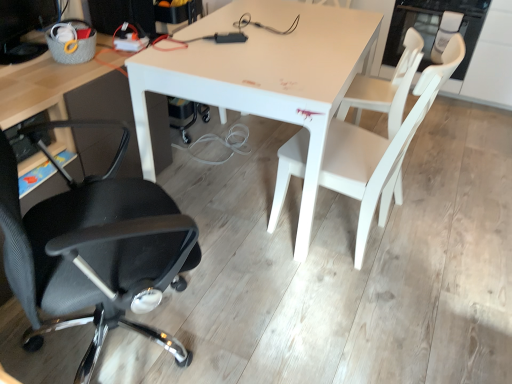
The image size is (512, 384). I want to click on matte black computer monitor at upper left, so click(x=24, y=28).

What is the approximate height of matte black computer monitor at upper left?

matte black computer monitor at upper left is 10.61 inches in height.

Locate an element on the screen. This screenshot has height=384, width=512. white matte chair at right, acting as the third chair starting from the left is located at coordinates (386, 87).

You are a GUI agent. You are given a task and a screenshot of the screen. Output one action in this format:
    pyautogui.click(x=<x>, y=<y>)
    Task: Click on the white matte table at center
    
    Given the screenshot: What is the action you would take?
    pyautogui.click(x=262, y=75)

Describe the element at coordinates (380, 152) in the screenshot. This screenshot has width=512, height=384. I see `white matte chair at center, which is counted as the second chair, starting from the right` at that location.

Locate an element on the screen. The image size is (512, 384). matte black computer monitor at upper left is located at coordinates (24, 28).

Between matte black computer monitor at upper left and white matte chair at right, acting as the third chair starting from the left, which one has more height?

white matte chair at right, acting as the third chair starting from the left.

How distant is matte black computer monitor at upper left from white matte chair at right, acting as the third chair starting from the left?

A distance of 1.43 meters exists between matte black computer monitor at upper left and white matte chair at right, acting as the third chair starting from the left.

Is point (11, 6) closer to camera compared to point (342, 106)?

Yes.

Locate an element on the screen. The image size is (512, 384). the 3rd chair located beneath the matte black computer monitor at upper left (from a real-world perspective) is located at coordinates (386, 87).

Considering the positions of points (291, 63) and (77, 381), is point (291, 63) closer to camera compared to point (77, 381)?

No, it is not.

From a real-world perspective, is white matte table at center located beneath black mesh office chair at left, arranged as the first chair when viewed from the left?

Yes, from a real-world perspective, white matte table at center is under black mesh office chair at left, arranged as the first chair when viewed from the left.

Does white matte table at center have a larger size compared to black mesh office chair at left, which is counted as the 3th chair, starting from the right?

Indeed, white matte table at center has a larger size compared to black mesh office chair at left, which is counted as the 3th chair, starting from the right.

Can you confirm if white matte table at center is shorter than black mesh office chair at left, arranged as the first chair when viewed from the left?

Correct, white matte table at center is not as tall as black mesh office chair at left, arranged as the first chair when viewed from the left.

Can we say black mesh office chair at left, which is counted as the 3th chair, starting from the right, lies outside white matte chair at center, which is counted as the second chair, starting from the right?

Yes, black mesh office chair at left, which is counted as the 3th chair, starting from the right, is located beyond the bounds of white matte chair at center, which is counted as the second chair, starting from the right.

Is black mesh office chair at left, arranged as the first chair when viewed from the left, facing towards white matte chair at center, the 2th chair in the left-to-right sequence?

Yes, black mesh office chair at left, arranged as the first chair when viewed from the left, is turned towards white matte chair at center, the 2th chair in the left-to-right sequence.

How different are the orientations of black mesh office chair at left, arranged as the first chair when viewed from the left, and white matte chair at center, which is counted as the second chair, starting from the right, in degrees?

black mesh office chair at left, arranged as the first chair when viewed from the left, and white matte chair at center, which is counted as the second chair, starting from the right, are facing 119 degrees away from each other.

Can you confirm if white matte chair at center, the 2th chair in the left-to-right sequence, is thinner than black mesh office chair at left, arranged as the first chair when viewed from the left?

Yes.

Is white matte chair at center, the 2th chair in the left-to-right sequence, touching black mesh office chair at left, arranged as the first chair when viewed from the left?

No, white matte chair at center, the 2th chair in the left-to-right sequence, is not next to black mesh office chair at left, arranged as the first chair when viewed from the left.

Is white matte chair at center, which is counted as the second chair, starting from the right, inside or outside of black mesh office chair at left, arranged as the first chair when viewed from the left?

white matte chair at center, which is counted as the second chair, starting from the right, lies outside black mesh office chair at left, arranged as the first chair when viewed from the left.

Which point is more distant from viewer, (418, 85) or (165, 348)?

The point (165, 348) is farther.

Is point (180, 85) in front of point (335, 138)?

Yes, it is in front of point (335, 138).

Which of these two, white matte table at center or white matte chair at center, the 2th chair in the left-to-right sequence, stands taller?

white matte chair at center, the 2th chair in the left-to-right sequence.

Is white matte table at center facing away from white matte chair at center, the 2th chair in the left-to-right sequence?

No.

What's the angular difference between white matte table at center and white matte chair at center, which is counted as the second chair, starting from the right,'s facing directions?

There is a 168-degree angle between the facing directions of white matte table at center and white matte chair at center, which is counted as the second chair, starting from the right.

Based on the photo, considering the sizes of objects white matte table at center and matte black computer monitor at upper left in the image provided, who is wider, white matte table at center or matte black computer monitor at upper left?

white matte table at center is wider.

Could matte black computer monitor at upper left be considered to be inside white matte table at center?

No, matte black computer monitor at upper left is not a part of white matte table at center.

From a real-world perspective, is white matte table at center physically above matte black computer monitor at upper left?

No.

From the image's perspective, is matte black computer monitor at upper left on white matte chair at center, which is counted as the second chair, starting from the right?

Yes, from the image's perspective, matte black computer monitor at upper left is over white matte chair at center, which is counted as the second chair, starting from the right.

Where is `the 2nd chair counting from the right of the matte black computer monitor at upper left`? the 2nd chair counting from the right of the matte black computer monitor at upper left is located at coordinates (380, 152).

In the scene shown: Relative to white matte chair at center, the 2th chair in the left-to-right sequence, is matte black computer monitor at upper left in front or behind?

Visually, matte black computer monitor at upper left is located behind white matte chair at center, the 2th chair in the left-to-right sequence.

How different are the orientations of matte black computer monitor at upper left and white matte chair at center, the 2th chair in the left-to-right sequence, in degrees?

The angle between the facing direction of matte black computer monitor at upper left and the facing direction of white matte chair at center, the 2th chair in the left-to-right sequence, is 159 degrees.

Where is `computer monitor on the left of white matte chair at right, which is the 1th chair from right to left`? computer monitor on the left of white matte chair at right, which is the 1th chair from right to left is located at coordinates (24, 28).

You are a GUI agent. You are given a task and a screenshot of the screen. Output one action in this format:
    pyautogui.click(x=<x>, y=<y>)
    Task: Click on the 2nd chair in front of the white matte table at center, counting from the anchor's position
    
    Given the screenshot: What is the action you would take?
    pyautogui.click(x=94, y=250)

Based on their spatial positions, is white matte chair at center, which is counted as the second chair, starting from the right, or matte black computer monitor at upper left further from black mesh office chair at left, arranged as the first chair when viewed from the left?

matte black computer monitor at upper left lies further to black mesh office chair at left, arranged as the first chair when viewed from the left, than the other object.

Considering their positions, is matte black computer monitor at upper left positioned further to white matte chair at center, the 2th chair in the left-to-right sequence, than black mesh office chair at left, which is counted as the 3th chair, starting from the right?

The object further to white matte chair at center, the 2th chair in the left-to-right sequence, is matte black computer monitor at upper left.

Looking at the image, which one is located closer to matte black computer monitor at upper left, white matte chair at right, which is the 1th chair from right to left, or white matte table at center?

Among the two, white matte table at center is located nearer to matte black computer monitor at upper left.

Estimate the real-world distances between objects in this image. Which object is further from white matte chair at right, which is the 1th chair from right to left, black mesh office chair at left, arranged as the first chair when viewed from the left, or white matte chair at center, which is counted as the second chair, starting from the right?

Based on the image, black mesh office chair at left, arranged as the first chair when viewed from the left, appears to be further to white matte chair at right, which is the 1th chair from right to left.

From the image, which object appears to be farther from matte black computer monitor at upper left, white matte chair at center, the 2th chair in the left-to-right sequence, or white matte table at center?

Among the two, white matte chair at center, the 2th chair in the left-to-right sequence, is located further to matte black computer monitor at upper left.

Which object lies further to the anchor point white matte chair at right, acting as the third chair starting from the left, white matte chair at center, which is counted as the second chair, starting from the right, or matte black computer monitor at upper left?

The object further to white matte chair at right, acting as the third chair starting from the left, is matte black computer monitor at upper left.

Which object lies nearer to the anchor point white matte chair at center, the 2th chair in the left-to-right sequence, white matte chair at right, which is the 1th chair from right to left, or matte black computer monitor at upper left?

Based on the image, white matte chair at right, which is the 1th chair from right to left, appears to be nearer to white matte chair at center, the 2th chair in the left-to-right sequence.

Estimate the real-world distances between objects in this image. Which object is closer to white matte table at center, white matte chair at right, which is the 1th chair from right to left, or black mesh office chair at left, which is counted as the 3th chair, starting from the right?

Among the two, white matte chair at right, which is the 1th chair from right to left, is located nearer to white matte table at center.

You are a GUI agent. You are given a task and a screenshot of the screen. Output one action in this format:
    pyautogui.click(x=<x>, y=<y>)
    Task: Click on the table between black mesh office chair at left, which is counted as the 3th chair, starting from the right, and white matte chair at center, which is counted as the second chair, starting from the right, from left to right
    This screenshot has height=384, width=512.
    Given the screenshot: What is the action you would take?
    pyautogui.click(x=262, y=75)

You are a GUI agent. You are given a task and a screenshot of the screen. Output one action in this format:
    pyautogui.click(x=<x>, y=<y>)
    Task: Click on the table between white matte chair at center, which is counted as the second chair, starting from the right, and white matte chair at right, which is the 1th chair from right to left, along the z-axis
    
    Given the screenshot: What is the action you would take?
    pyautogui.click(x=262, y=75)

This screenshot has width=512, height=384. I want to click on chair situated between matte black computer monitor at upper left and white matte chair at center, the 2th chair in the left-to-right sequence, from left to right, so click(x=94, y=250).

Image resolution: width=512 pixels, height=384 pixels. I want to click on table located between matte black computer monitor at upper left and white matte chair at center, which is counted as the second chair, starting from the right, in the left-right direction, so click(262, 75).